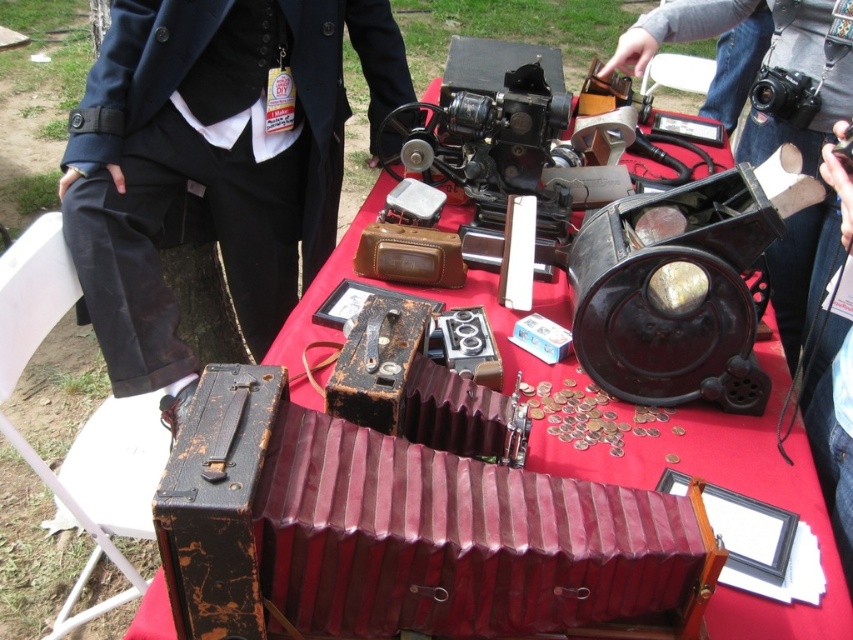
Which of these two, leather-like maroon accordion at center or matte black camera at center, stands shorter?

Standing shorter between the two is leather-like maroon accordion at center.

Who is more distant from viewer, (619, 573) or (827, 337)?

Point (827, 337)

Locate an element on the screen. The image size is (853, 640). leather-like maroon accordion at center is located at coordinates (405, 534).

Does black fabric coat at upper left have a lesser height compared to matte black camera at center?

Incorrect, black fabric coat at upper left's height does not fall short of matte black camera at center's.

Which is in front, point (244, 4) or point (732, 26)?

Positioned in front is point (244, 4).

Who is more forward, (144, 342) or (700, 13)?

Point (144, 342) is more forward.

Where is `black fabric coat at upper left`? black fabric coat at upper left is located at coordinates (213, 161).

The image size is (853, 640). Find the location of `leather-like maroon accordion at center`. leather-like maroon accordion at center is located at coordinates (405, 534).

Which of these two, leather-like maroon accordion at center or black fabric coat at upper left, stands shorter?

leather-like maroon accordion at center

Between point (239, 508) and point (267, 45), which one is positioned in front?

Point (239, 508)

Find the location of `leather-like maroon accordion at center`. leather-like maroon accordion at center is located at coordinates (405, 534).